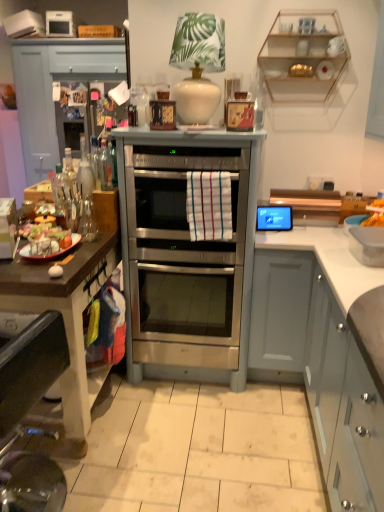
This screenshot has height=512, width=384. I want to click on free space above white matte cabinet at center, which ranks as the 2th cabinetry in bottom-to-top order (from a real-world perspective), so click(x=281, y=231).